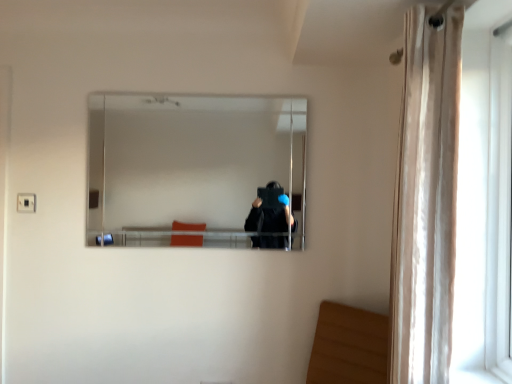
Question: Can you confirm if clear glass mirror at center is thinner than beige sheer curtain at right?

Choices:
 (A) no
 (B) yes

Answer: (B)

Question: Is clear glass mirror at center far from beige sheer curtain at right?

Choices:
 (A) yes
 (B) no

Answer: (A)

Question: Does clear glass mirror at center turn towards beige sheer curtain at right?

Choices:
 (A) yes
 (B) no

Answer: (A)

Question: Is beige sheer curtain at right at the back of clear glass mirror at center?

Choices:
 (A) no
 (B) yes

Answer: (A)

Question: Is the surface of clear glass mirror at center in direct contact with beige sheer curtain at right?

Choices:
 (A) no
 (B) yes

Answer: (A)

Question: Would you say beige sheer curtain at right is to the left or to the right of clear glass mirror at center in the picture?

Choices:
 (A) left
 (B) right

Answer: (B)

Question: From the image's perspective, is beige sheer curtain at right located above or below clear glass mirror at center?

Choices:
 (A) above
 (B) below

Answer: (B)

Question: From a real-world perspective, relative to clear glass mirror at center, is beige sheer curtain at right vertically above or below?

Choices:
 (A) below
 (B) above

Answer: (A)

Question: Considering the positions of point (390, 359) and point (158, 223), is point (390, 359) closer or farther from the camera than point (158, 223)?

Choices:
 (A) farther
 (B) closer

Answer: (B)

Question: Based on their sizes in the image, would you say beige sheer curtain at right is bigger or smaller than white plastic screen door at right?

Choices:
 (A) big
 (B) small

Answer: (A)

Question: Considering the positions of beige sheer curtain at right and white plastic screen door at right in the image, is beige sheer curtain at right taller or shorter than white plastic screen door at right?

Choices:
 (A) tall
 (B) short

Answer: (A)

Question: Visually, is beige sheer curtain at right positioned to the left or to the right of white plastic screen door at right?

Choices:
 (A) right
 (B) left

Answer: (B)

Question: Is beige sheer curtain at right wider or thinner than white plastic screen door at right?

Choices:
 (A) wide
 (B) thin

Answer: (A)

Question: From the image's perspective, is clear glass mirror at center located above or below beige sheer curtain at right?

Choices:
 (A) below
 (B) above

Answer: (B)

Question: Does point (192, 145) appear closer or farther from the camera than point (448, 367)?

Choices:
 (A) farther
 (B) closer

Answer: (A)